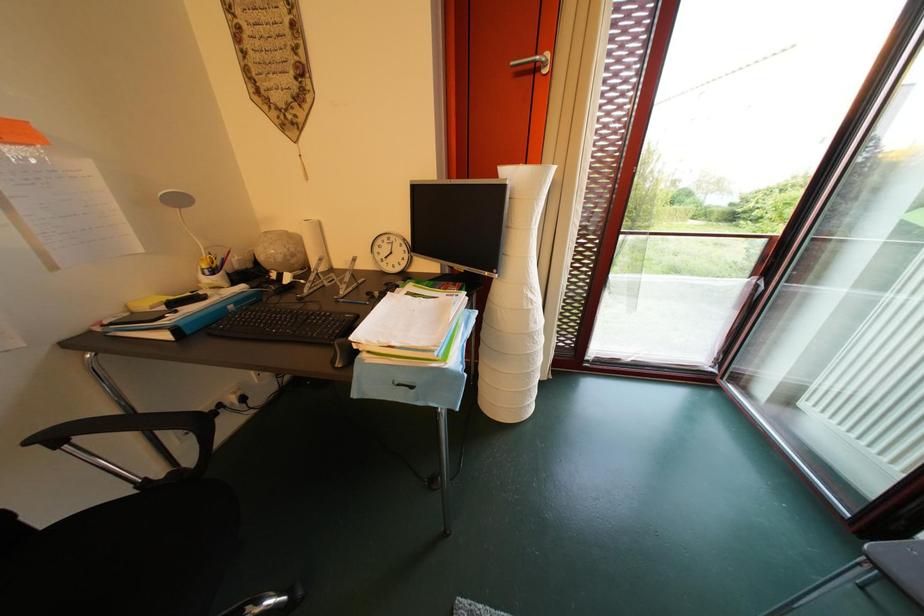
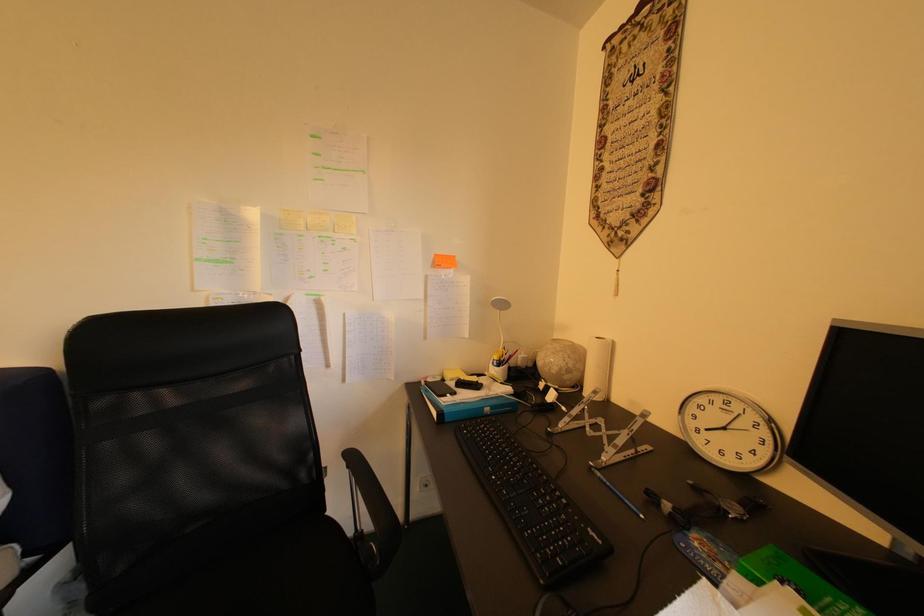
Question: Based on the continuous images, in which direction is the camera rotating? Reply with the corresponding letter.

Choices:
 (A) Left
 (B) Right
 (C) Up
 (D) Down

Answer: (A)